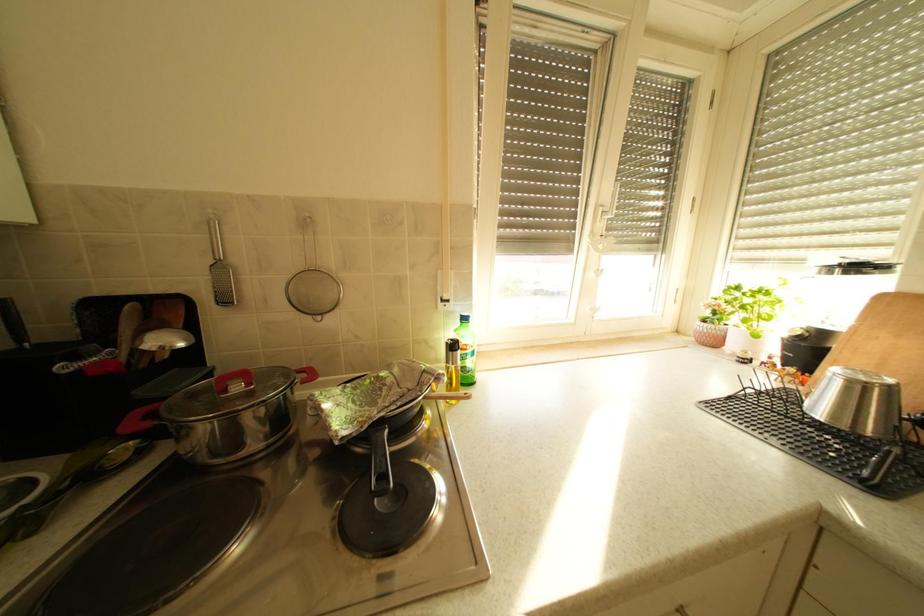
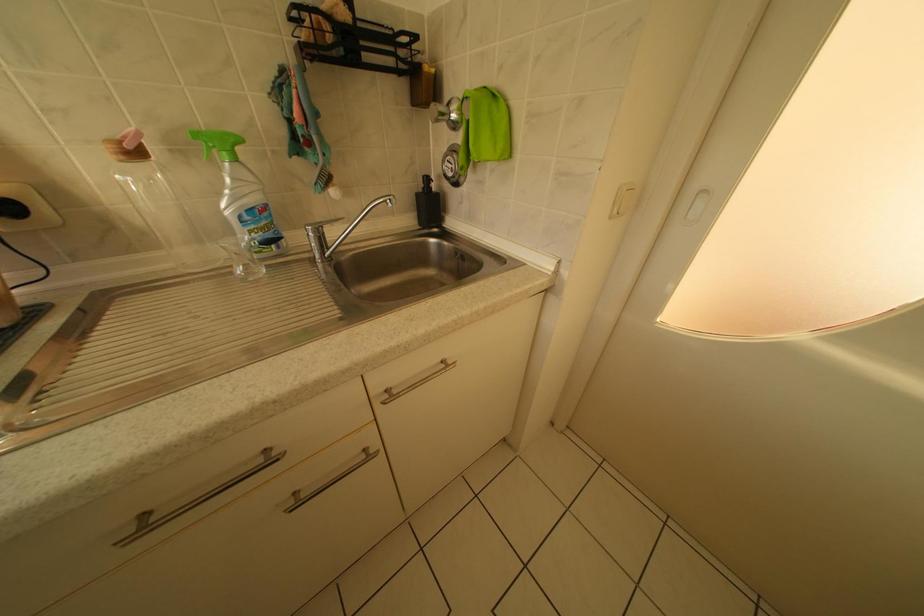
How did the camera likely rotate?

The camera's rotation is toward right-down.